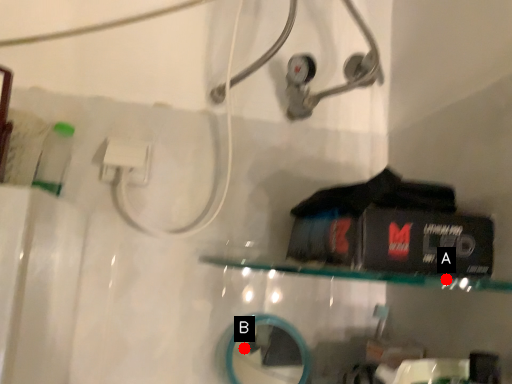
Question: Two points are circled on the image, labeled by A and B beside each circle. Which point appears farthest from the camera in this image?

Choices:
 (A) A is further
 (B) B is further

Answer: (B)